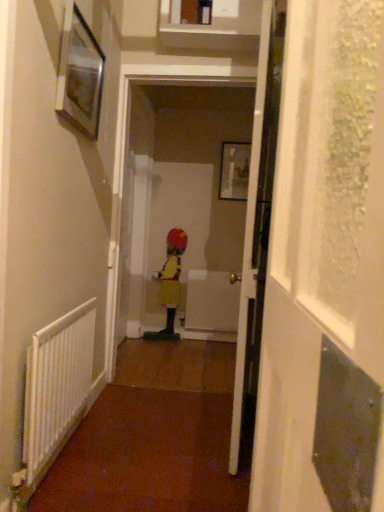
Question: Considering their positions, is white plastic radiator at left located in front of or behind yellow matte dress at center?

Choices:
 (A) behind
 (B) front

Answer: (B)

Question: Looking at their shapes, would you say white plastic radiator at left is wider or thinner than yellow matte dress at center?

Choices:
 (A) thin
 (B) wide

Answer: (A)

Question: Based on their relative distances, which object is nearer to the matte black picture frame at upper center, the second picture frame when ordered from left to right?

Choices:
 (A) metallic silver picture frame at upper left, marked as the 2th picture frame in a back-to-front arrangement
 (B) white plastic radiator at left
 (C) white glossy door at center
 (D) yellow matte dress at center
 (E) transparent textured screen door at right

Answer: (D)

Question: Considering the real-world distances, which object is closest to the metallic silver picture frame at upper left, placed as the first picture frame when sorted from left to right?

Choices:
 (A) white glossy door at center
 (B) matte black picture frame at upper center, which is counted as the second picture frame, starting from the front
 (C) yellow matte dress at center
 (D) transparent textured screen door at right
 (E) white plastic radiator at left

Answer: (A)